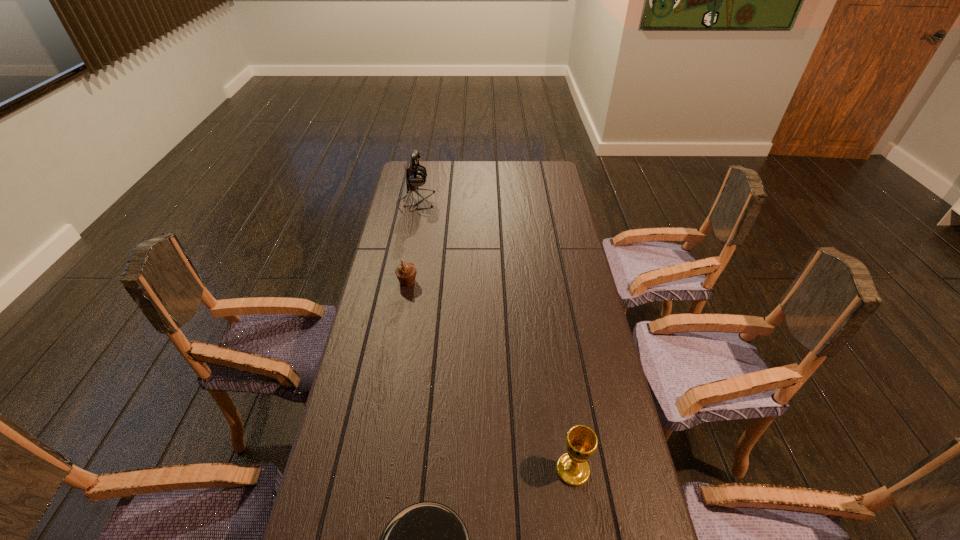
The image size is (960, 540). I want to click on muffin at the left edge, so click(x=406, y=272).

Find the location of a particular element. This screenshot has width=960, height=540. object situated at the right edge is located at coordinates (572, 467).

At what (x,y) coordinates should I click in order to perform the action: click on free point at the far edge. Please return your answer as a coordinate pair (x, y). The width and height of the screenshot is (960, 540). Looking at the image, I should click on (488, 172).

The height and width of the screenshot is (540, 960). I want to click on vacant space at the left edge of the desktop, so click(392, 420).

In the image, there is a desktop. Find the location of `free region at the right edge`. free region at the right edge is located at coordinates [x=544, y=221].

The width and height of the screenshot is (960, 540). I want to click on free area in between the earphone and the second shortest object, so click(412, 242).

This screenshot has width=960, height=540. I want to click on free space that is in between the third tallest object and the chalice, so click(491, 376).

Locate an element on the screen. free spot between the farthest object and the rightmost object is located at coordinates (494, 335).

Find the location of a particular element. This screenshot has height=540, width=960. free space that is in between the earphone and the rightmost object is located at coordinates (494, 335).

Where is `vacant space that is in between the earphone and the muffin`? vacant space that is in between the earphone and the muffin is located at coordinates (412, 242).